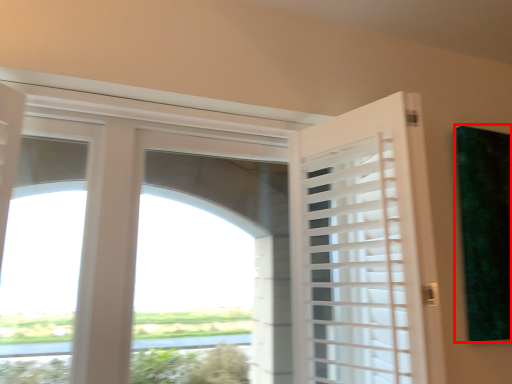
Question: From the image's perspective, what is the correct spatial positioning of window screen (annotated by the red box) in reference to door?

Choices:
 (A) below
 (B) above

Answer: (B)